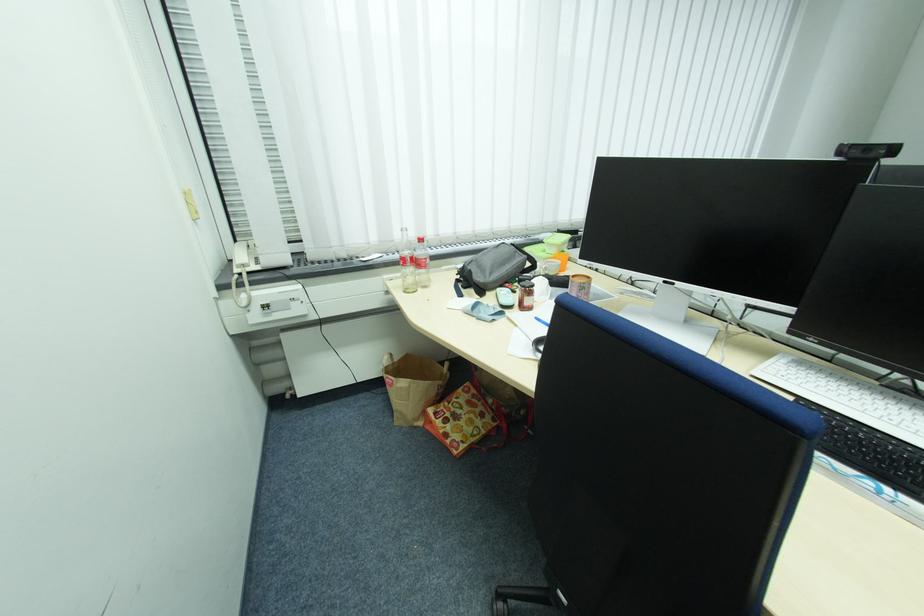
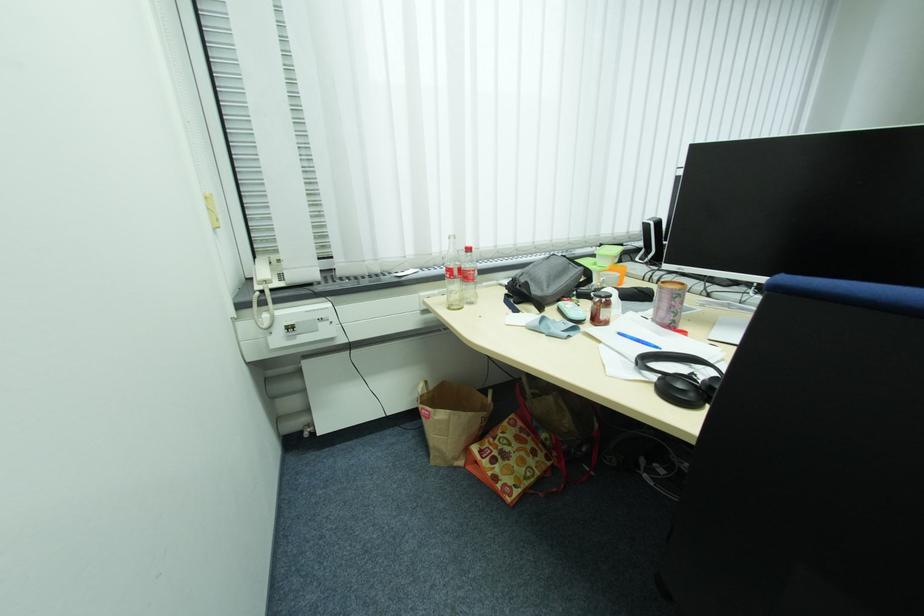
Question: I am providing you with two images of the same scene from different viewpoints. After the viewpoint changes to image2, which objects are now occluded?

Choices:
 (A) light blue case
 (B) orange plastic cup
 (C) small glass jar
 (D) none of these

Answer: (D)